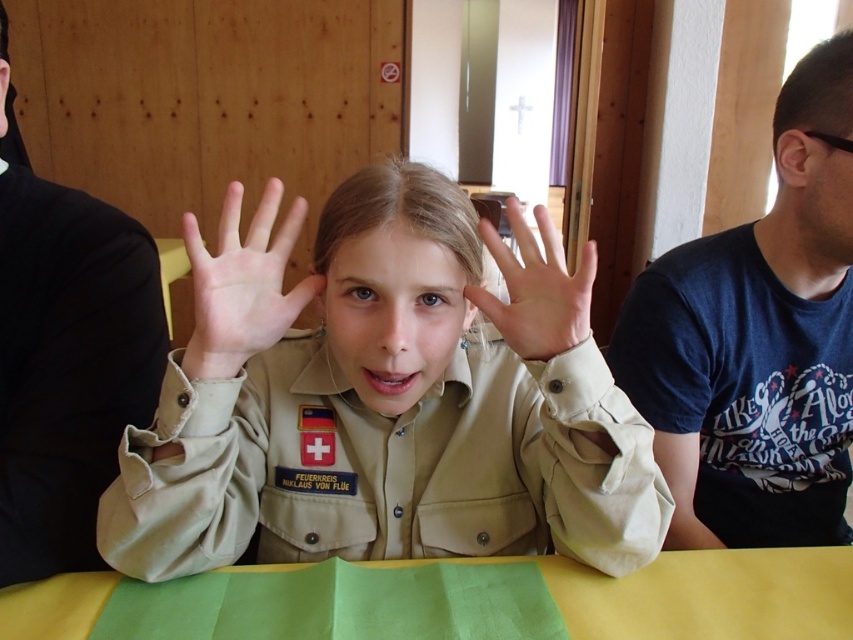
The girl is wearing a tan uniform at center and has a matte beige hand at center. Which object takes up more space horizontally in the image?

The tan uniform at center takes up more space horizontally than the matte beige hand at center because its width is larger.